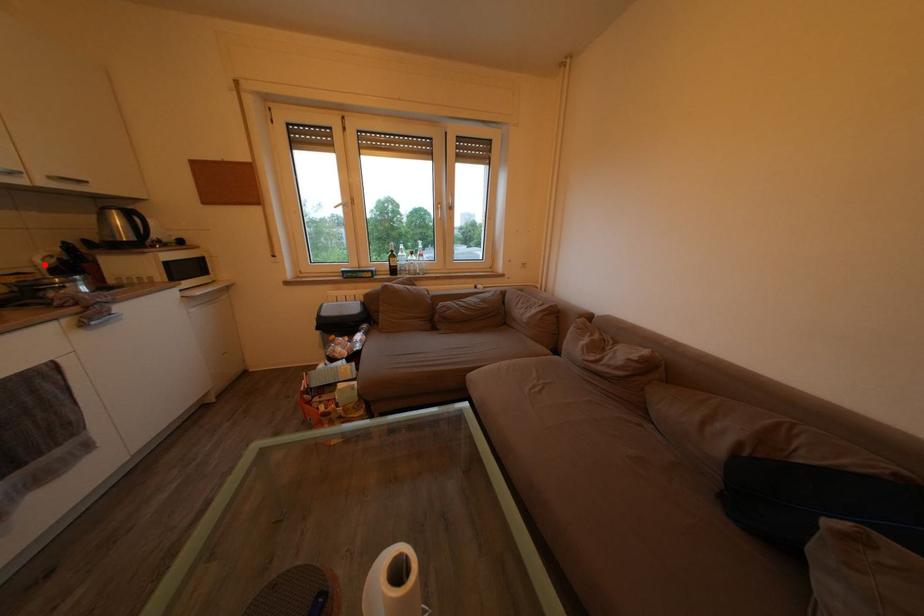
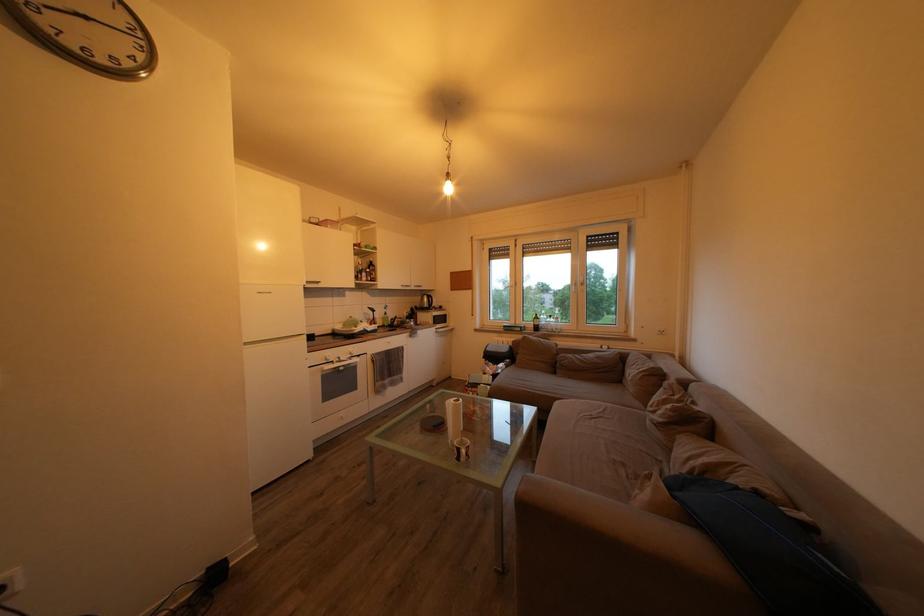
The point at the highlighted location is marked in the first image. Where is the corresponding point in the second image?

(412, 318)